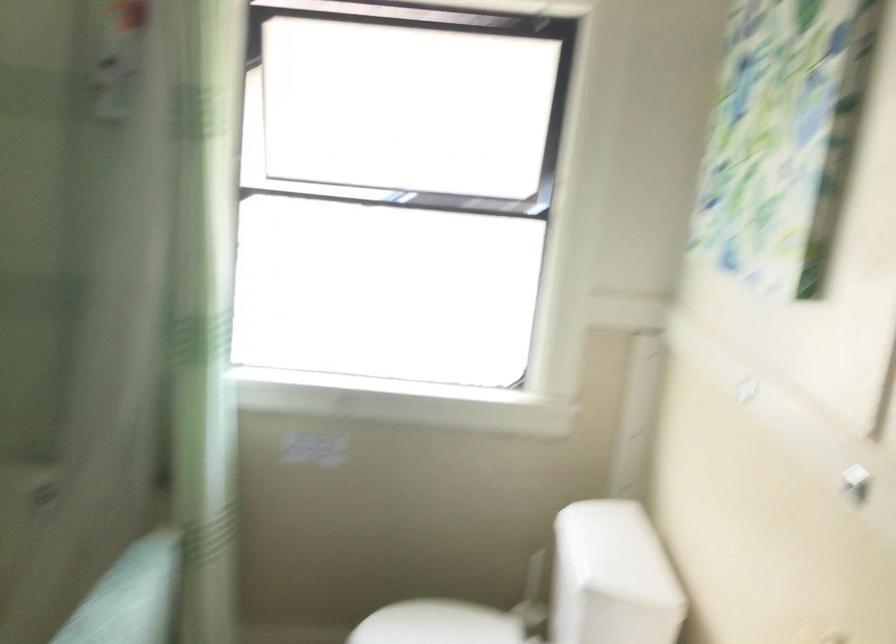
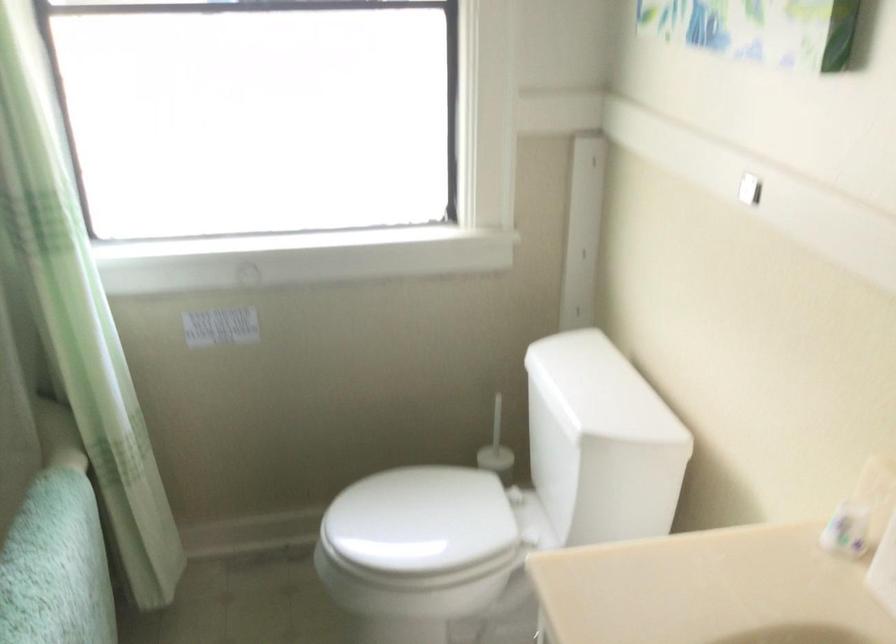
The point at (x=613, y=554) is marked in the first image. Where is the corresponding point in the second image?

(599, 390)